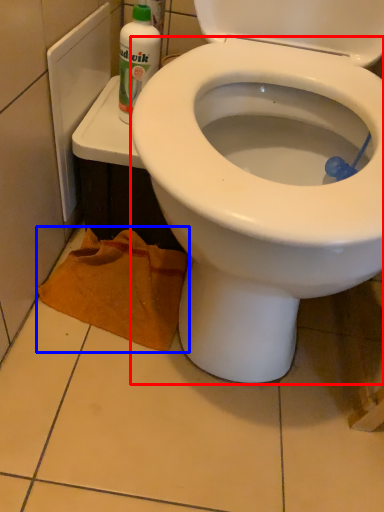
Question: Which point is closer to the camera, bidet (highlighted by a red box) or material (highlighted by a blue box)?

Choices:
 (A) bidet
 (B) material

Answer: (A)